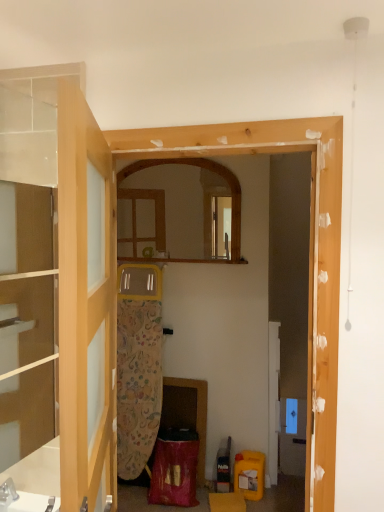
Question: Does wooden mirror at center appear on the left side of clear glass door at left?

Choices:
 (A) no
 (B) yes

Answer: (A)

Question: Does wooden mirror at center come behind clear glass door at left?

Choices:
 (A) no
 (B) yes

Answer: (B)

Question: Can you confirm if wooden mirror at center is wider than clear glass door at left?

Choices:
 (A) no
 (B) yes

Answer: (A)

Question: Is wooden mirror at center oriented away from clear glass door at left?

Choices:
 (A) yes
 (B) no

Answer: (B)

Question: From the image's perspective, would you say wooden mirror at center is positioned over clear glass door at left?

Choices:
 (A) yes
 (B) no

Answer: (A)

Question: From a real-world perspective, does wooden mirror at center sit lower than clear glass door at left?

Choices:
 (A) no
 (B) yes

Answer: (A)

Question: From a real-world perspective, does wooden mirror at center sit lower than transparent glass cabinet at left?

Choices:
 (A) no
 (B) yes

Answer: (A)

Question: Is transparent glass cabinet at left at the back of wooden mirror at center?

Choices:
 (A) no
 (B) yes

Answer: (A)

Question: Can you see wooden mirror at center touching transparent glass cabinet at left?

Choices:
 (A) no
 (B) yes

Answer: (A)

Question: Is wooden mirror at center outside of transparent glass cabinet at left?

Choices:
 (A) yes
 (B) no

Answer: (A)

Question: Does wooden mirror at center come behind transparent glass cabinet at left?

Choices:
 (A) no
 (B) yes

Answer: (B)

Question: Is wooden mirror at center aimed at transparent glass cabinet at left?

Choices:
 (A) no
 (B) yes

Answer: (B)

Question: From a real-world perspective, is clear glass door at left beneath transparent glass cabinet at left?

Choices:
 (A) yes
 (B) no

Answer: (A)